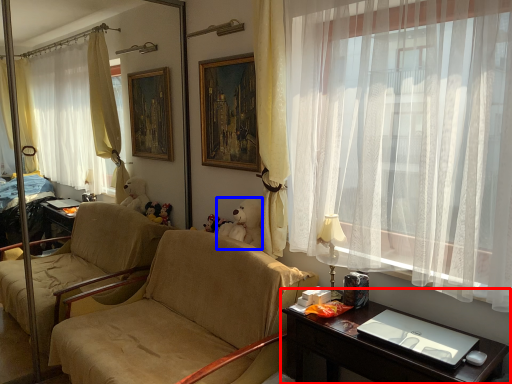
Question: Which point is closer to the camera, desk (highlighted by a red box) or teddy bear (highlighted by a blue box)?

Choices:
 (A) desk
 (B) teddy bear

Answer: (A)